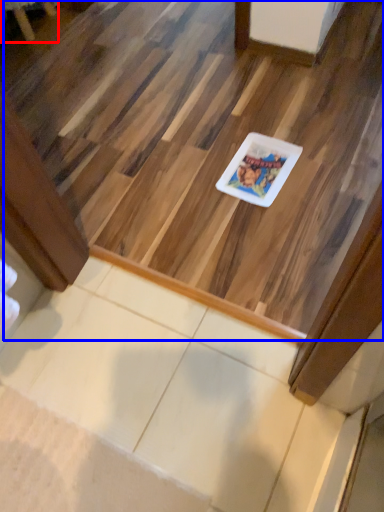
Question: Which object is closer to the camera taking this photo, furniture (highlighted by a red box) or stairwell (highlighted by a blue box)?

Choices:
 (A) furniture
 (B) stairwell

Answer: (B)